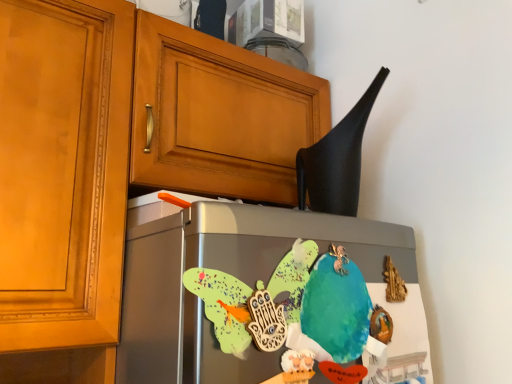
Find the location of `free space above satin silver fridge at center (from a real-world perspective)`. free space above satin silver fridge at center (from a real-world perspective) is located at coordinates (324, 233).